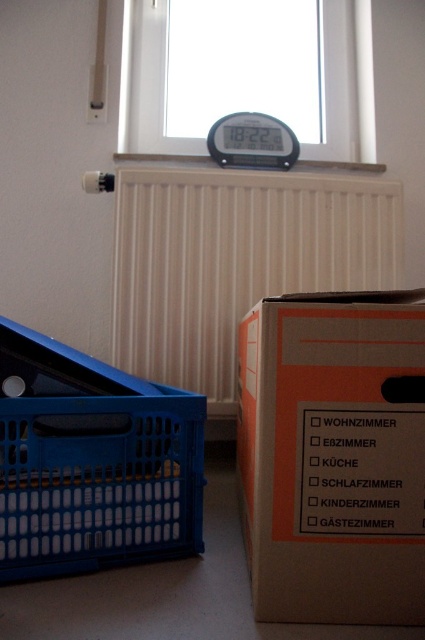
You are moving a small plant that is 10 inches wide. You want to place it between the white matte radiator at center and the blue plastic laundry basket at lower left. Is there enough space?

The white matte radiator at center and blue plastic laundry basket at lower left are 20.29 inches apart from each other. Since the plant is only 10 inches wide, there is enough space between them to place the plant.

You are standing in the room and want to place a small potted plant on the nearest object to you between the white matte radiator at center and the blue plastic laundry basket at lower left. Which object should you choose?

You should place the potted plant on the white matte radiator at center because it is closer to you than the blue plastic laundry basket at lower left.